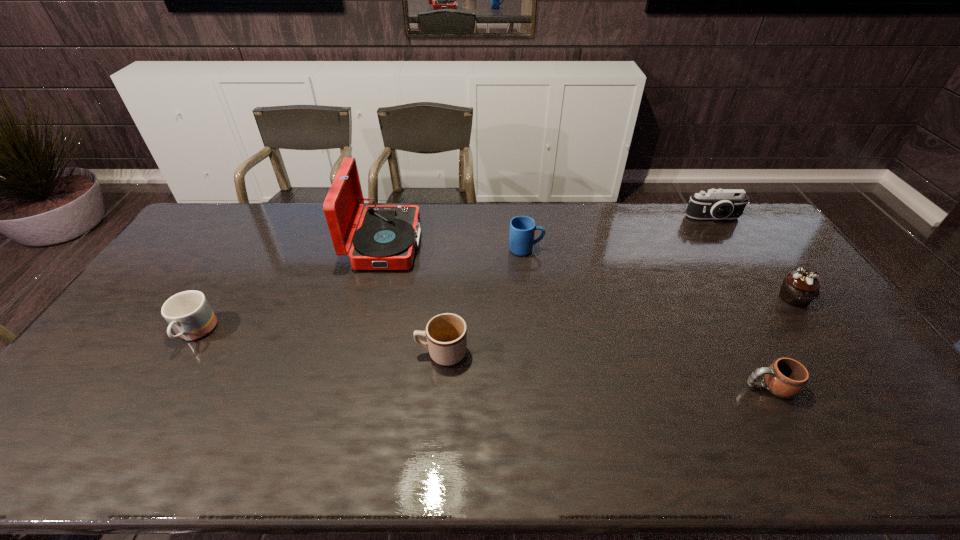
Where is `free region that satisfies the following two spatial constraints: 1. on the front-facing side of the tallest object; 2. on the side with the handle of the leftmost mug`? The height and width of the screenshot is (540, 960). free region that satisfies the following two spatial constraints: 1. on the front-facing side of the tallest object; 2. on the side with the handle of the leftmost mug is located at coordinates (363, 334).